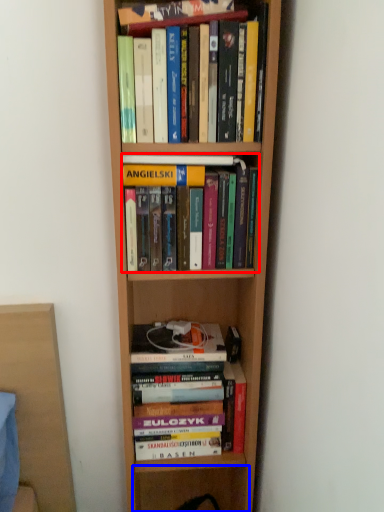
Question: Which object is further to the camera taking this photo, book (highlighted by a red box) or shelf (highlighted by a blue box)?

Choices:
 (A) book
 (B) shelf

Answer: (B)